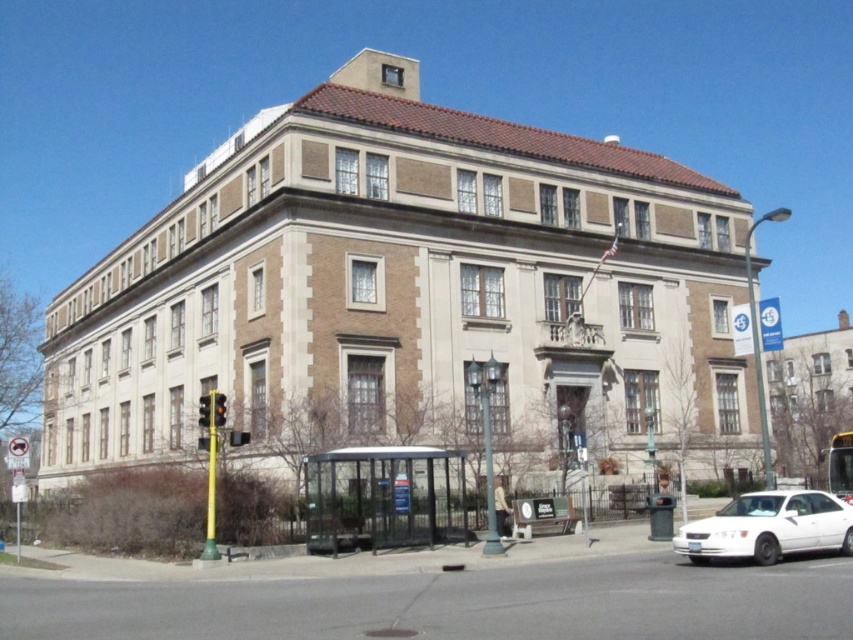
You are a delivery person needing to park your 15 meter long truck. You see the metallic silver bench at lower center and the amber glass traffic light at center. Can you fit your truck between them without hitting either?

The metallic silver bench at lower center and the amber glass traffic light at center are 15.16 meters apart, so yes, the truck can fit between them since the distance is slightly longer than the truck.

Consider the image. You are standing at the entrance of the large multi story building with classical architecture. You want to catch a bus. Where should you go to reach the clear glass bus stop at lower center?

The clear glass bus stop at lower center is located at point (383, 499), so you should head towards that coordinate to reach it.